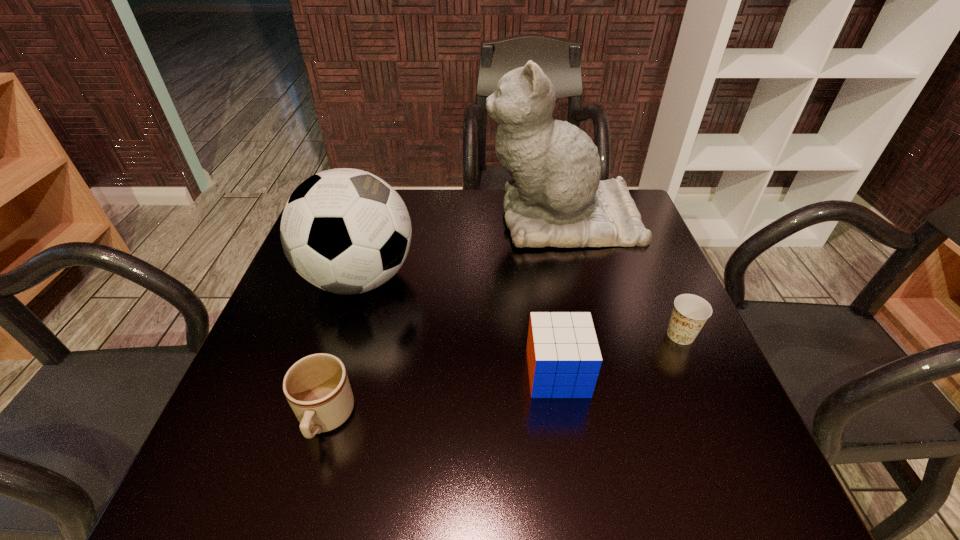
Where is `vacant area that lies between the cat and the cube`? This screenshot has width=960, height=540. vacant area that lies between the cat and the cube is located at coordinates (560, 295).

Identify the location of free spot between the fourth shortest object and the shortest object. (520, 307).

The height and width of the screenshot is (540, 960). Find the location of `blank region between the tallest object and the mug`. blank region between the tallest object and the mug is located at coordinates (444, 318).

Locate an element on the screen. This screenshot has height=540, width=960. free space between the cat and the shortest object is located at coordinates (621, 276).

This screenshot has width=960, height=540. What are the coordinates of `unoccupied area between the cube and the shortest object` in the screenshot? It's located at (619, 354).

The width and height of the screenshot is (960, 540). Find the location of `vacant point located between the third nearest object and the second tallest object`. vacant point located between the third nearest object and the second tallest object is located at coordinates tap(520, 307).

Find the location of `free point between the soccer ball and the tallest object`. free point between the soccer ball and the tallest object is located at coordinates (461, 248).

Identify the location of object that is the fourth closest to the soccer ball. This screenshot has width=960, height=540. (690, 312).

This screenshot has height=540, width=960. Identify the location of object that is the third nearest to the second tallest object. (563, 355).

Find the location of a particular element. vacant area that satisfies the following two spatial constraints: 1. on the back side of the Dixie cup; 2. on the main logo of the soccer ball is located at coordinates (656, 278).